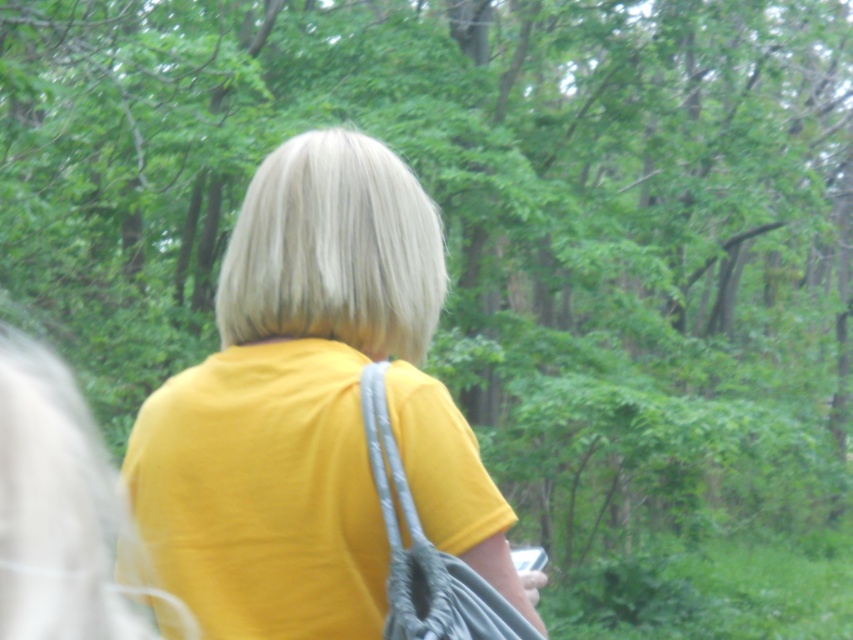
You are standing in a forest and see two points in the image. The first point is at coordinate point (x=390, y=284), and the second is at coordinate point (x=408, y=554). Which point is closer to you?

Point (x=390, y=284) is closer to you because it is further to the viewer than point (x=408, y=554).